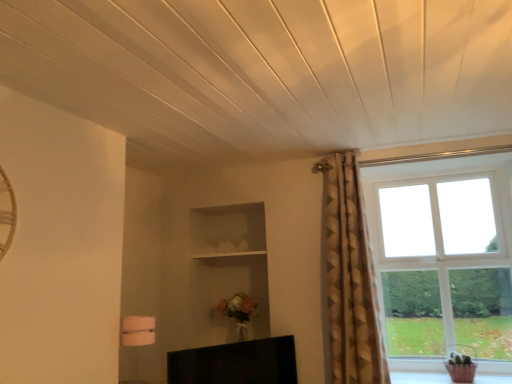
Question: Would you say white wooden shelf at center is to the left or to the right of clear glass window at right in the picture?

Choices:
 (A) right
 (B) left

Answer: (B)

Question: Is white wooden shelf at center wider or thinner than clear glass window at right?

Choices:
 (A) wide
 (B) thin

Answer: (A)

Question: Considering the real-world distances, which object is farthest from the white wooden shelf at center?

Choices:
 (A) gold textured curtain at upper right
 (B) clear glass window at right
 (C) black glossy tv at lower center

Answer: (B)

Question: Which is farther from the black glossy tv at lower center?

Choices:
 (A) gold textured curtain at upper right
 (B) clear glass window at right
 (C) white wooden shelf at center

Answer: (B)